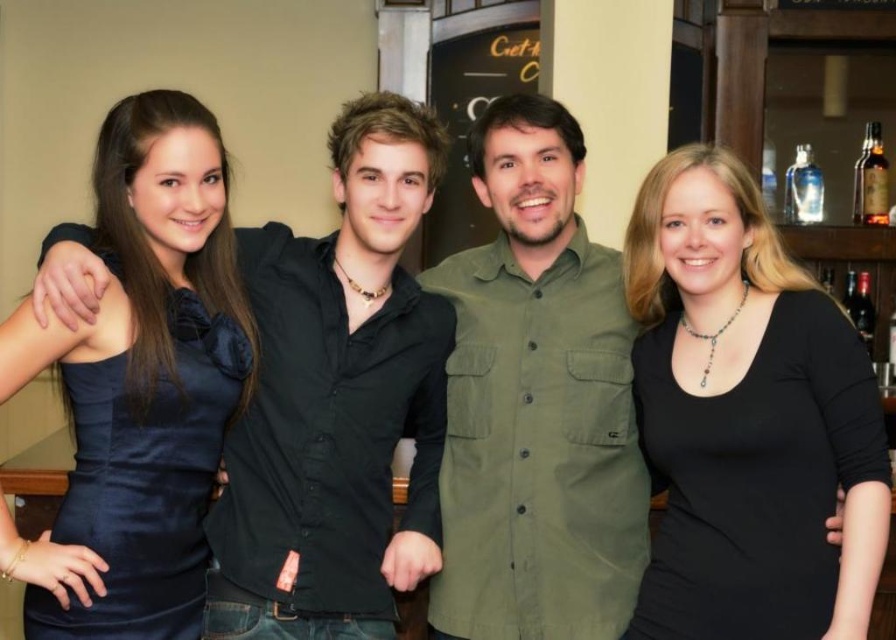
You are a photographer holding a camera that requires a minimum distance of 2 meters between the subject and the camera to focus properly. You want to take a photo of the black matte shirt at center and the brown glass bottle at upper right in the same frame. Will the camera be able to focus on both subjects?

The black matte shirt at center and the brown glass bottle at upper right are 1.99 meters apart from each other. Since the required minimum distance is 2 meters, the camera cannot focus properly on both subjects as they are slightly too close together.